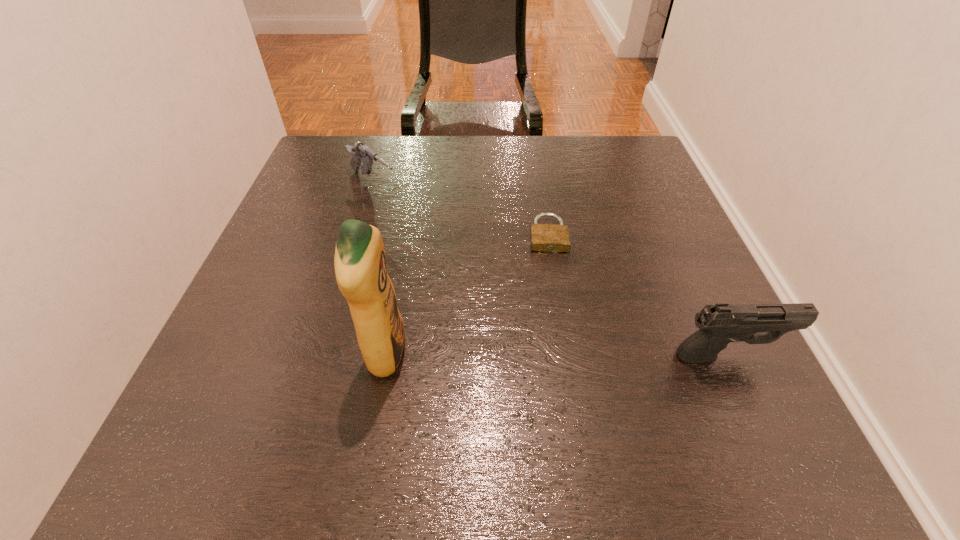
Where is `free spot between the pistol and the third object from left to right`? This screenshot has width=960, height=540. free spot between the pistol and the third object from left to right is located at coordinates (637, 295).

The width and height of the screenshot is (960, 540). Identify the location of vacant point located between the third nearest object and the gun. (461, 210).

The height and width of the screenshot is (540, 960). In order to click on vacant space that's between the third object from left to right and the third shortest object in this screenshot , I will do `click(637, 295)`.

The width and height of the screenshot is (960, 540). In order to click on free spot between the shortest object and the farthest object in this screenshot , I will do `click(461, 210)`.

The height and width of the screenshot is (540, 960). Identify the location of empty space between the pistol and the third object from left to right. (637, 295).

Where is `object that can be found as the second closest to the second tallest object`? Image resolution: width=960 pixels, height=540 pixels. object that can be found as the second closest to the second tallest object is located at coordinates (360, 263).

This screenshot has width=960, height=540. Find the location of `object that is the second nearest to the detergent`. object that is the second nearest to the detergent is located at coordinates (360, 152).

The height and width of the screenshot is (540, 960). Find the location of `free space that satisfies the following two spatial constraints: 1. on the front side of the tallest object; 2. on the label of the third tallest object`. free space that satisfies the following two spatial constraints: 1. on the front side of the tallest object; 2. on the label of the third tallest object is located at coordinates (324, 354).

The width and height of the screenshot is (960, 540). In order to click on vacant region that satisfies the following two spatial constraints: 1. on the front side of the third shortest object; 2. at the barrel of the second shortest object in this screenshot , I will do (324, 355).

Image resolution: width=960 pixels, height=540 pixels. Find the location of `vacant region that satisfies the following two spatial constraints: 1. on the front side of the detergent; 2. on the label of the farthest object`. vacant region that satisfies the following two spatial constraints: 1. on the front side of the detergent; 2. on the label of the farthest object is located at coordinates (324, 354).